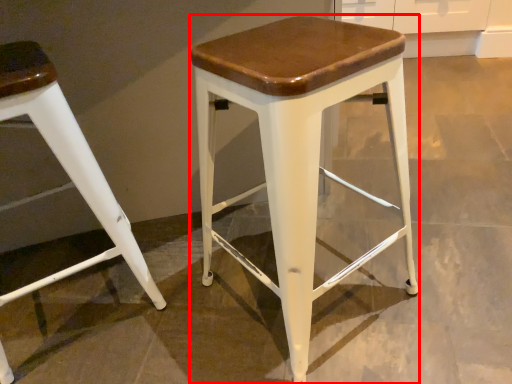
Question: Observing the image, what is the correct spatial positioning of stool (annotated by the red box) in reference to stool?

Choices:
 (A) right
 (B) left

Answer: (A)